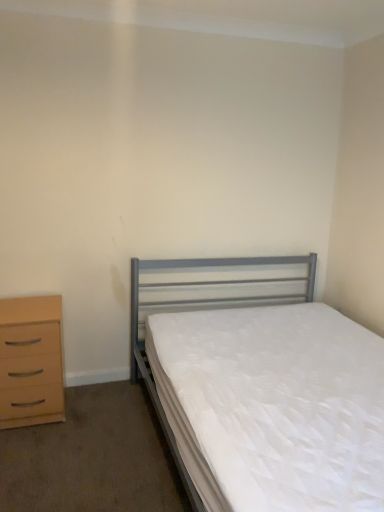
Question: Considering the positions of metallic gray bed at center and light wood/texture chest of drawers at left in the image, is metallic gray bed at center taller or shorter than light wood/texture chest of drawers at left?

Choices:
 (A) short
 (B) tall

Answer: (B)

Question: Which is correct: metallic gray bed at center is inside light wood/texture chest of drawers at left, or outside of it?

Choices:
 (A) outside
 (B) inside

Answer: (A)

Question: Is point (349, 451) closer or farther from the camera than point (41, 415)?

Choices:
 (A) closer
 (B) farther

Answer: (A)

Question: From their relative heights in the image, would you say light wood/texture chest of drawers at left is taller or shorter than metallic gray bed at center?

Choices:
 (A) short
 (B) tall

Answer: (A)

Question: From the image's perspective, relative to metallic gray bed at center, is light wood/texture chest of drawers at left above or below?

Choices:
 (A) above
 (B) below

Answer: (B)

Question: Considering the positions of point (18, 318) and point (307, 501), is point (18, 318) closer or farther from the camera than point (307, 501)?

Choices:
 (A) closer
 (B) farther

Answer: (B)

Question: In the image, is light wood/texture chest of drawers at left positioned in front of or behind metallic gray bed at center?

Choices:
 (A) behind
 (B) front

Answer: (A)